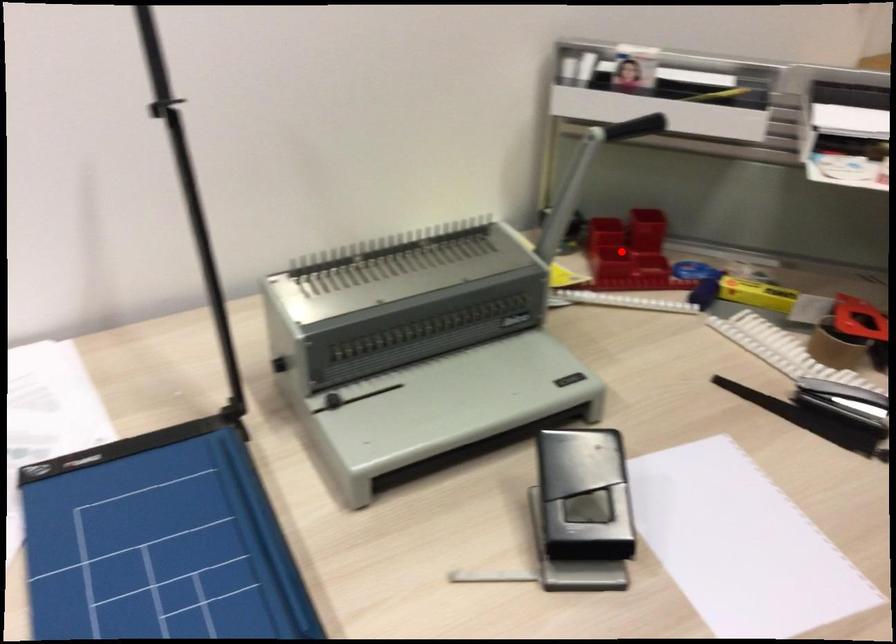
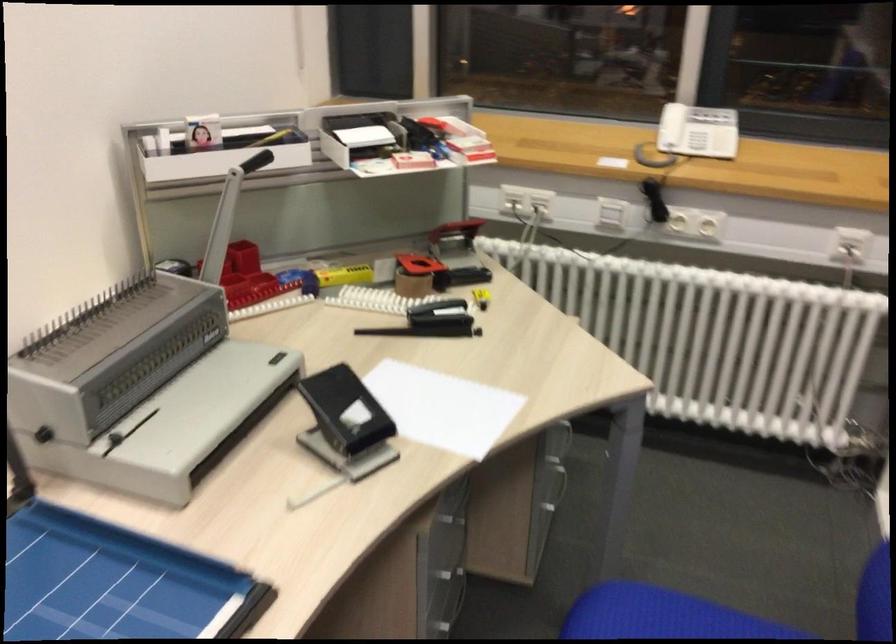
In the second image, find the point that corresponds to the highlighted location in the first image.

(245, 277)